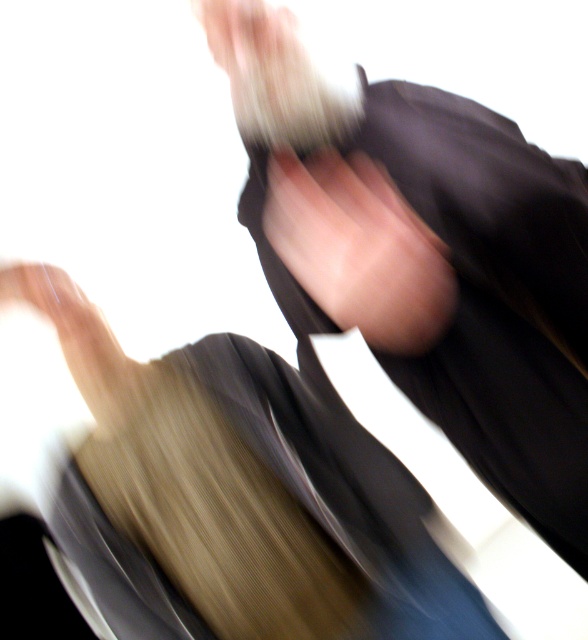
Looking at this image, you are standing in the scene and want to reach the point at coordinates (372, 188). If your arm can extend 60 centimeters, can you reach it?

The point at coordinates (372, 188) is 71.35 centimeters away from the viewer. Since your arm can only extend 60 centimeters, you cannot reach it.

You are an artist trying to sketch the scene. You notice the smooth skin at center and the smooth beige hand at lower left. Which object should you draw first if you want to capture the one that is wider?

The smooth skin at center might be wider than the smooth beige hand at lower left, so you should draw the smooth skin at center first to capture the wider object.

Based on the scene description, where is the smooth skin at center positioned in terms of coordinates?

The smooth skin at center is located at point coordinates of 0.391 on the x axis and 0.612 on the y axis.